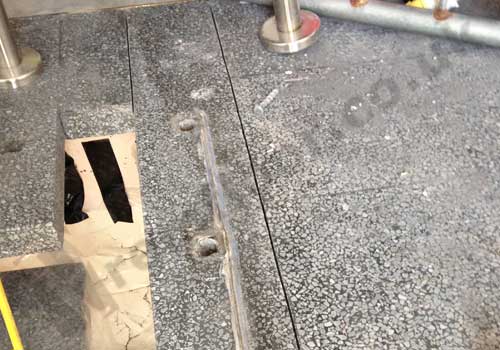
The width and height of the screenshot is (500, 350). In order to click on railing support in this screenshot , I will do `click(307, 49)`.